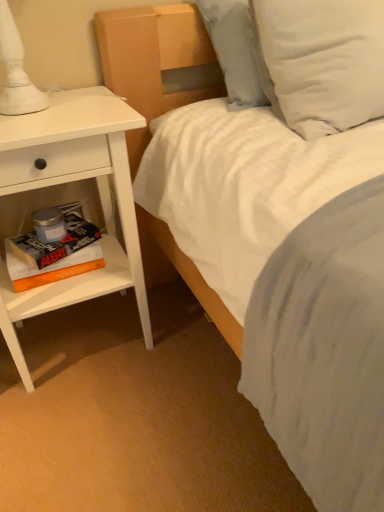
Question: Is white textured pillow at upper right, which is the 2th pillow in right-to-left order, facing towards hardcover book at left, which is counted as the second paperback book, starting from the bottom?

Choices:
 (A) yes
 (B) no

Answer: (B)

Question: Is hardcover book at left, which is the 1th paperback book in top-to-bottom order, at the back of white textured pillow at upper right, which is counted as the first pillow, starting from the left?

Choices:
 (A) no
 (B) yes

Answer: (A)

Question: Is white textured pillow at upper right, which is counted as the first pillow, starting from the left, at the right side of hardcover book at left, which is counted as the second paperback book, starting from the bottom?

Choices:
 (A) yes
 (B) no

Answer: (A)

Question: From the image's perspective, is white textured pillow at upper right, which is the 2th pillow in right-to-left order, beneath hardcover book at left, which is the 1th paperback book in top-to-bottom order?

Choices:
 (A) yes
 (B) no

Answer: (B)

Question: Considering the relative positions of white textured pillow at upper right, which is counted as the first pillow, starting from the left, and hardcover book at left, which is the 1th paperback book in top-to-bottom order, in the image provided, is white textured pillow at upper right, which is counted as the first pillow, starting from the left, behind hardcover book at left, which is the 1th paperback book in top-to-bottom order,?

Choices:
 (A) yes
 (B) no

Answer: (B)

Question: Would you say hardcover book at left, which is the 1th paperback book in top-to-bottom order, is to the left or to the right of white textured pillow at upper right, which is the 2th pillow in right-to-left order, in the picture?

Choices:
 (A) right
 (B) left

Answer: (B)

Question: Is hardcover book at left, which is counted as the second paperback book, starting from the bottom, bigger or smaller than white textured pillow at upper right, which is the 2th pillow in right-to-left order?

Choices:
 (A) small
 (B) big

Answer: (A)

Question: In terms of width, does hardcover book at left, which is the 1th paperback book in top-to-bottom order, look wider or thinner when compared to white textured pillow at upper right, which is the 2th pillow in right-to-left order?

Choices:
 (A) wide
 (B) thin

Answer: (B)

Question: Would you say hardcover book at left, which is counted as the second paperback book, starting from the bottom, is inside or outside white textured pillow at upper right, which is counted as the first pillow, starting from the left?

Choices:
 (A) outside
 (B) inside

Answer: (A)

Question: From a real-world perspective, is white matte nightstand at left above or below white soft pillow at upper right, arranged as the 1th pillow when viewed from the right?

Choices:
 (A) below
 (B) above

Answer: (A)

Question: Looking at the image, does white matte nightstand at left seem bigger or smaller compared to white soft pillow at upper right, arranged as the 1th pillow when viewed from the right?

Choices:
 (A) big
 (B) small

Answer: (A)

Question: Considering the positions of white matte nightstand at left and white soft pillow at upper right, arranged as the 1th pillow when viewed from the right, in the image, is white matte nightstand at left taller or shorter than white soft pillow at upper right, arranged as the 1th pillow when viewed from the right,?

Choices:
 (A) short
 (B) tall

Answer: (B)

Question: Do you think white matte nightstand at left is within white soft pillow at upper right, acting as the second pillow starting from the left, or outside of it?

Choices:
 (A) inside
 (B) outside

Answer: (B)

Question: Based on their positions, is orange matte book at lower left, which is counted as the 1th paperback book, starting from the bottom, located to the left or right of white soft pillow at upper right, arranged as the 1th pillow when viewed from the right?

Choices:
 (A) right
 (B) left

Answer: (B)

Question: From a real-world perspective, is orange matte book at lower left, which ranks as the 2th paperback book in top-to-bottom order, positioned above or below white soft pillow at upper right, arranged as the 1th pillow when viewed from the right?

Choices:
 (A) below
 (B) above

Answer: (A)